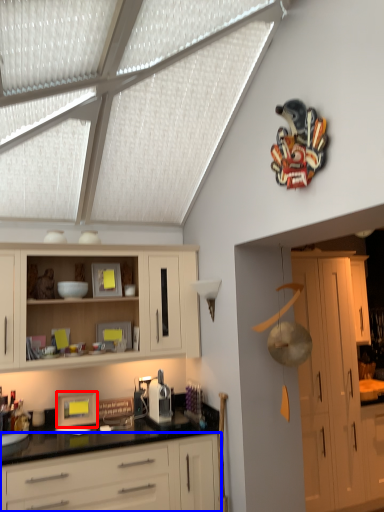
Question: Which object appears farthest to the camera in this image, picture frame (highlighted by a red box) or cabinetry (highlighted by a blue box)?

Choices:
 (A) picture frame
 (B) cabinetry

Answer: (A)